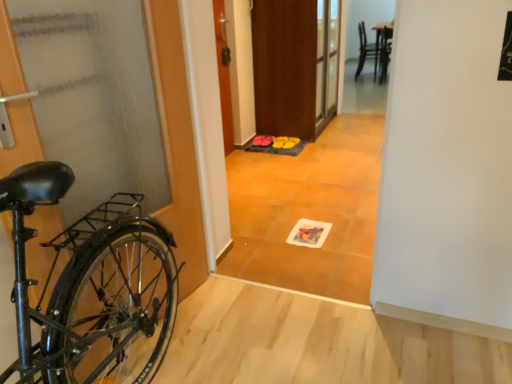
What do you see at coordinates (177, 141) in the screenshot?
I see `matte gray door at left, placed as the 2th door when sorted from top to bottom` at bounding box center [177, 141].

Describe the element at coordinates (224, 75) in the screenshot. I see `wooden door at center, arranged as the second door when viewed from the front` at that location.

In order to face brown wooden screen door at center, should I rotate leftwards or rightwards?

A 6.264 degree turn to the right will do.

What is the approximate height of matte orange floor mat at center?

It is 1.30 meters.

You are a GUI agent. You are given a task and a screenshot of the screen. Output one action in this format:
    pyautogui.click(x=<x>, y=<y>)
    Task: Click on the matte pink shoes at center
    
    Given the screenshot: What is the action you would take?
    pyautogui.click(x=262, y=140)

In the scene shown: In the image, is matte pink shoes at center positioned in front of or behind matte gray door at left, the first door ordered from the bottom?

In the image, matte pink shoes at center appears behind matte gray door at left, the first door ordered from the bottom.

From the image's perspective, relative to matte gray door at left, placed as the 2th door when sorted from top to bottom, is matte pink shoes at center above or below?

Clearly, from the image's perspective, matte pink shoes at center is above matte gray door at left, placed as the 2th door when sorted from top to bottom.

From a real-world perspective, which object rests below the other?

matte pink shoes at center.

What are the coordinates of `door that is the 1st object above the matte pink shoes at center (from a real-world perspective)` in the screenshot? It's located at (177, 141).

Considering the positions of points (278, 22) and (229, 149), is point (278, 22) closer to camera compared to point (229, 149)?

Yes, it is in front of point (229, 149).

Is brown wooden screen door at center spatially inside wooden door at center, which is the 1th door from back to front, or outside of it?

The correct answer is: outside.

From the image's perspective, which object appears higher, brown wooden screen door at center or wooden door at center, the first door when ordered from top to bottom?

brown wooden screen door at center appears higher in the image.

Considering the relative sizes of wooden chair at upper right and wooden door at center, which is the 2th door from bottom to top, in the image provided, is wooden chair at upper right shorter than wooden door at center, which is the 2th door from bottom to top,?

Correct, wooden chair at upper right is not as tall as wooden door at center, which is the 2th door from bottom to top.

From a real-world perspective, between wooden chair at upper right and wooden door at center, which is the 1th door from back to front, who is vertically higher?

wooden door at center, which is the 1th door from back to front.

Can you see wooden chair at upper right touching wooden door at center, arranged as the second door when viewed from the front?

No, wooden chair at upper right is not making contact with wooden door at center, arranged as the second door when viewed from the front.

Does wooden chair at upper right have a lesser width compared to wooden door at center, arranged as the second door when viewed from the front?

No.

From the picture: Is the position of matte orange floor mat at center more distant than that of wooden door at center, arranged as the second door when viewed from the front?

No, the depth of matte orange floor mat at center is less than that of wooden door at center, arranged as the second door when viewed from the front.

From a real-world perspective, is matte orange floor mat at center positioned under wooden door at center, which is the 1th door from back to front, based on gravity?

No.

Is matte orange floor mat at center to the left or to the right of wooden door at center, the first door when ordered from top to bottom, in the image?

matte orange floor mat at center is positioned on wooden door at center, the first door when ordered from top to bottom,'s right side.

Could you tell me if matte orange floor mat at center is facing wooden door at center, arranged as the second door when viewed from the front?

No, matte orange floor mat at center does not turn towards wooden door at center, arranged as the second door when viewed from the front.

Is point (223, 74) closer or farther from the camera than point (270, 66)?

Point (223, 74) is positioned closer to the camera compared to point (270, 66).

Would you say brown wooden screen door at center is part of wooden door at center, which is the 1th door from back to front,'s contents?

Actually, brown wooden screen door at center is outside wooden door at center, which is the 1th door from back to front.

From a real-world perspective, is wooden door at center, the first door when ordered from top to bottom, located beneath brown wooden screen door at center?

No, from a real-world perspective, wooden door at center, the first door when ordered from top to bottom, is not beneath brown wooden screen door at center.

Where is `screen door on the left of wooden chair at upper right`? screen door on the left of wooden chair at upper right is located at coordinates (285, 67).

Could you tell me if brown wooden screen door at center is facing wooden chair at upper right?

No, brown wooden screen door at center is not oriented towards wooden chair at upper right.

Does brown wooden screen door at center have a lesser height compared to wooden chair at upper right?

No.

From the image's perspective, which is below, brown wooden screen door at center or wooden chair at upper right?

brown wooden screen door at center, from the image's perspective.

From the image's perspective, is matte orange floor mat at center located beneath wooden chair at upper right?

Yes, from the image's perspective, matte orange floor mat at center is beneath wooden chair at upper right.

In the scene shown: Is matte orange floor mat at center far away from wooden chair at upper right?

Yes.

From a real-world perspective, is matte orange floor mat at center physically located above or below wooden chair at upper right?

From a real-world perspective, matte orange floor mat at center is physically above wooden chair at upper right.

Visually, is matte orange floor mat at center positioned to the left or to the right of wooden chair at upper right?

From the image, it's evident that matte orange floor mat at center is to the left of wooden chair at upper right.

I want to click on footwear below the matte gray door at left, the first door ordered from the bottom (from a real-world perspective), so [262, 140].

At what (x,y) coordinates should I click in order to perform the action: click on screen door above the wooden door at center, the first door when ordered from top to bottom (from the image's perspective). Please return your answer as a coordinate pair (x, y). Image resolution: width=512 pixels, height=384 pixels. Looking at the image, I should click on (285, 67).

Which object lies further to the anchor point wooden door at center, which is the 1th door from back to front, matte orange floor mat at center or matte gray door at left, placed as the 2th door when sorted from top to bottom?

Among the two, matte gray door at left, placed as the 2th door when sorted from top to bottom, is located further to wooden door at center, which is the 1th door from back to front.

Considering their positions, is wooden door at center, the first door when ordered from top to bottom, positioned further to matte pink shoes at center than wooden chair at upper right?

The object further to matte pink shoes at center is wooden chair at upper right.

From the picture: Estimate the real-world distances between objects in this image. Which object is closer to matte pink shoes at center, matte gray door at left, the first door ordered from the bottom, or matte orange floor mat at center?

matte orange floor mat at center.

From the image, which object appears to be nearer to brown wooden screen door at center, wooden door at center, which is the 2th door from bottom to top, or matte pink shoes at center?

wooden door at center, which is the 2th door from bottom to top, is positioned closer to the anchor brown wooden screen door at center.

Which object lies nearer to the anchor point wooden chair at upper right, matte gray door at left, placed as the 2th door when sorted from back to front, or brown wooden screen door at center?

brown wooden screen door at center is positioned closer to the anchor wooden chair at upper right.

Which object lies nearer to the anchor point wooden chair at upper right, wooden door at center, which is the 1th door from back to front, or matte pink shoes at center?

matte pink shoes at center.

Based on their spatial positions, is matte orange floor mat at center or wooden chair at upper right further from brown wooden screen door at center?

The object further to brown wooden screen door at center is wooden chair at upper right.

When comparing their distances from brown wooden screen door at center, does matte orange floor mat at center or matte pink shoes at center seem closer?

matte pink shoes at center lies closer to brown wooden screen door at center than the other object.

Image resolution: width=512 pixels, height=384 pixels. I want to click on footwear positioned between wooden door at center, arranged as the second door when viewed from the front, and wooden chair at upper right from near to far, so click(262, 140).

Where is `corridor positioned between matte gray door at left, placed as the 2th door when sorted from top to bottom, and matte pink shoes at center from near to far`? The height and width of the screenshot is (384, 512). corridor positioned between matte gray door at left, placed as the 2th door when sorted from top to bottom, and matte pink shoes at center from near to far is located at coordinates (313, 202).

Locate an element on the screen. The width and height of the screenshot is (512, 384). screen door located between matte gray door at left, placed as the 2th door when sorted from back to front, and matte pink shoes at center in the depth direction is located at coordinates (285, 67).

Where is `screen door positioned between matte gray door at left, placed as the 2th door when sorted from top to bottom, and wooden chair at upper right from near to far`? Image resolution: width=512 pixels, height=384 pixels. screen door positioned between matte gray door at left, placed as the 2th door when sorted from top to bottom, and wooden chair at upper right from near to far is located at coordinates (285, 67).